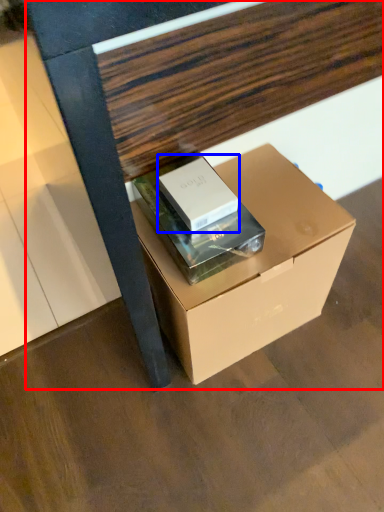
Question: Among these objects, which one is farthest to the camera, furniture (highlighted by a red box) or box (highlighted by a blue box)?

Choices:
 (A) furniture
 (B) box

Answer: (B)